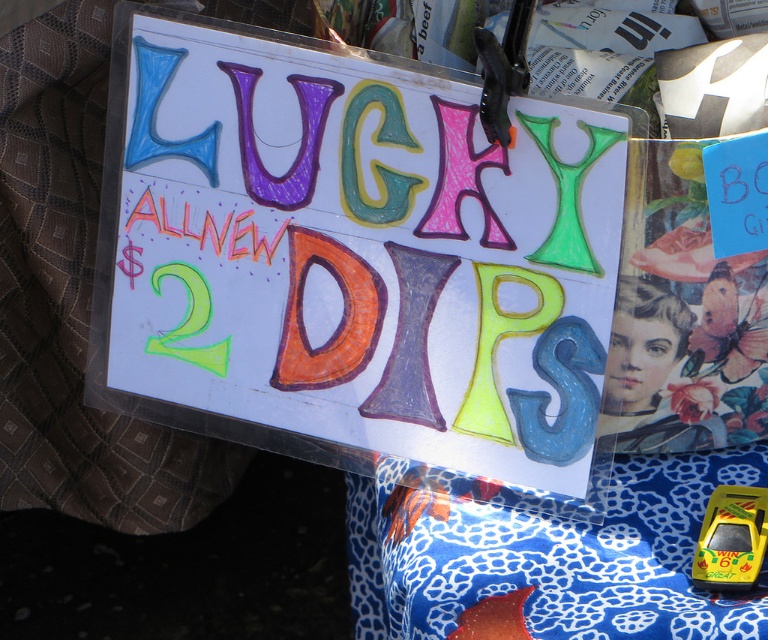
Which of these two, hand-drawn paper sign at center or yellow plastic toy car at center, stands taller?

hand-drawn paper sign at center

Does hand-drawn paper sign at center come behind yellow plastic toy car at center?

Yes, hand-drawn paper sign at center is behind yellow plastic toy car at center.

Between point (404, 83) and point (707, 508), which one is positioned behind?

Point (707, 508)

Where is `hand-drawn paper sign at center`? The height and width of the screenshot is (640, 768). hand-drawn paper sign at center is located at coordinates (351, 256).